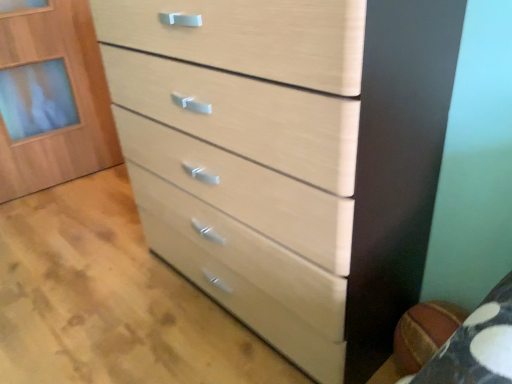
Question: Is light wood drawer at center oriented away from light wood cabinet at upper left?

Choices:
 (A) yes
 (B) no

Answer: (B)

Question: Is light wood drawer at center wider than light wood cabinet at upper left?

Choices:
 (A) yes
 (B) no

Answer: (A)

Question: Considering the relative sizes of light wood drawer at center and light wood cabinet at upper left in the image provided, is light wood drawer at center thinner than light wood cabinet at upper left?

Choices:
 (A) no
 (B) yes

Answer: (A)

Question: Is light wood drawer at center directly adjacent to light wood cabinet at upper left?

Choices:
 (A) yes
 (B) no

Answer: (B)

Question: Is light wood drawer at center taller than light wood cabinet at upper left?

Choices:
 (A) no
 (B) yes

Answer: (A)

Question: From the image's perspective, would you say light wood drawer at center is shown under light wood cabinet at upper left?

Choices:
 (A) yes
 (B) no

Answer: (A)

Question: Would you say light wood/texture chest of drawers at center is a long distance from light wood cabinet at upper left?

Choices:
 (A) no
 (B) yes

Answer: (B)

Question: From a real-world perspective, is light wood/texture chest of drawers at center positioned under light wood cabinet at upper left based on gravity?

Choices:
 (A) no
 (B) yes

Answer: (A)

Question: Is light wood/texture chest of drawers at center facing away from light wood cabinet at upper left?

Choices:
 (A) no
 (B) yes

Answer: (A)

Question: Is light wood cabinet at upper left surrounded by light wood/texture chest of drawers at center?

Choices:
 (A) no
 (B) yes

Answer: (A)

Question: Can you confirm if light wood/texture chest of drawers at center is shorter than light wood cabinet at upper left?

Choices:
 (A) no
 (B) yes

Answer: (A)

Question: From a real-world perspective, is light wood/texture chest of drawers at center positioned over light wood cabinet at upper left based on gravity?

Choices:
 (A) no
 (B) yes

Answer: (B)

Question: From a real-world perspective, is light wood cabinet at upper left beneath light wood/texture chest of drawers at center?

Choices:
 (A) no
 (B) yes

Answer: (B)